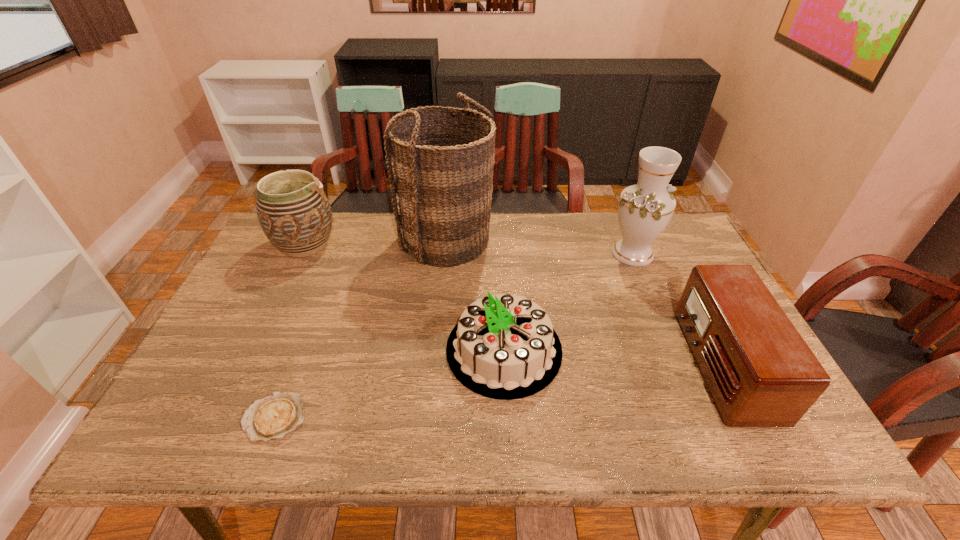
Locate an element on the screen. Image resolution: width=960 pixels, height=540 pixels. basket is located at coordinates (441, 175).

You are a GUI agent. You are given a task and a screenshot of the screen. Output one action in this format:
    pyautogui.click(x=<x>, y=<y>)
    Task: Click on the vase
    Image resolution: width=960 pixels, height=540 pixels.
    Given the screenshot: What is the action you would take?
    pyautogui.click(x=644, y=210)

You are a GUI agent. You are given a task and a screenshot of the screen. Output one action in this format:
    pyautogui.click(x=<x>, y=<y>)
    Task: Click on the pottery
    
    Given the screenshot: What is the action you would take?
    pyautogui.click(x=293, y=210)

In order to click on birthday cake in this screenshot , I will do `click(504, 347)`.

Image resolution: width=960 pixels, height=540 pixels. Identify the location of radio receiver. tap(761, 373).

Locate an element on the screen. This screenshot has width=960, height=540. the shortest object is located at coordinates (280, 413).

The image size is (960, 540). I want to click on vacant space located on the left of the tallest object, so click(287, 240).

At what (x,y) coordinates should I click in order to perform the action: click on free location located on the front of the vase. Please return your answer as a coordinate pair (x, y). This screenshot has height=540, width=960. Looking at the image, I should click on (678, 364).

You are a GUI agent. You are given a task and a screenshot of the screen. Output one action in this format:
    pyautogui.click(x=<x>, y=<y>)
    Task: Click on the vacant space located 0.140m on the front of the fourth shortest object
    This screenshot has width=960, height=540.
    Given the screenshot: What is the action you would take?
    pyautogui.click(x=280, y=299)

Identify the location of vacant space located 0.260m on the right of the birthday cake. This screenshot has height=540, width=960. (667, 350).